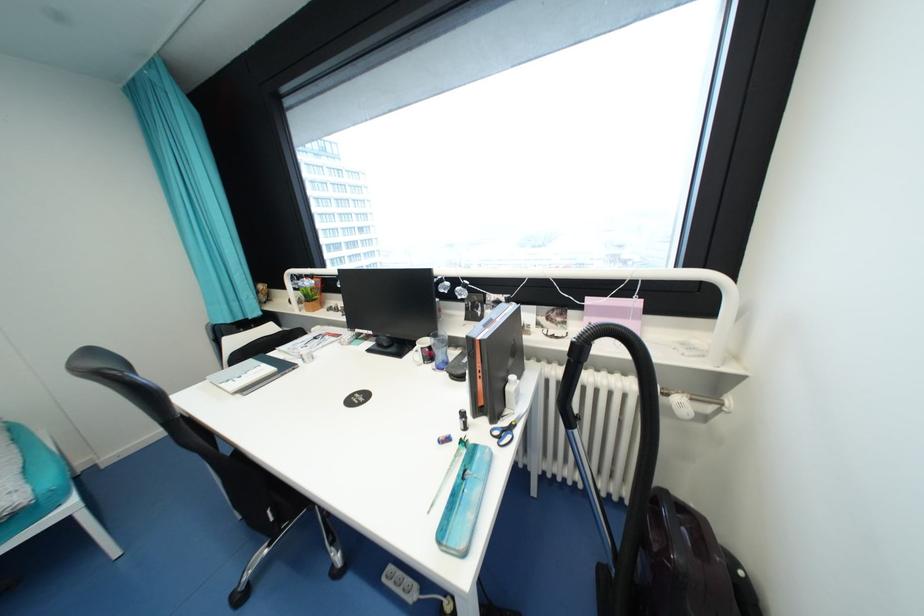
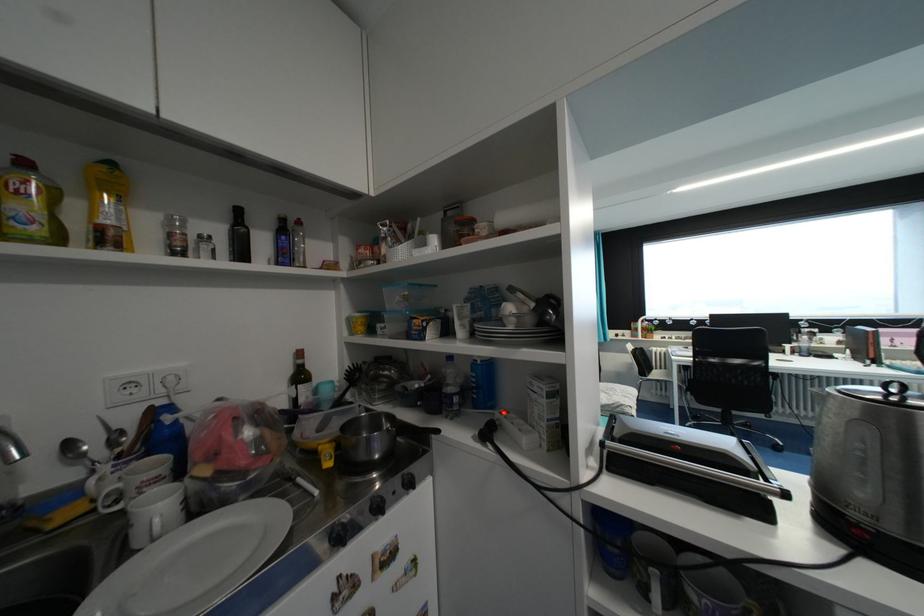
The images are taken continuously from a first-person perspective. In which direction are you moving?

The cameraman walked toward left, backward.